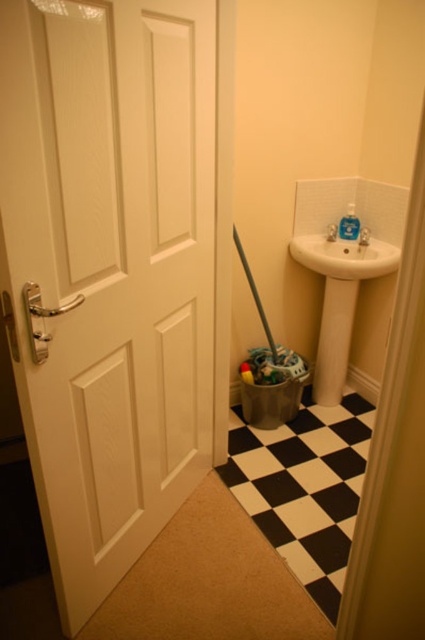
Question: Which of these objects is positioned farthest from the white matte door at left?

Choices:
 (A) white glossy sink at upper right
 (B) metallic silver brush at center

Answer: (A)

Question: Can you confirm if white matte door at left is bigger than white glossy sink at upper right?

Choices:
 (A) no
 (B) yes

Answer: (B)

Question: Which of the following is the closest to the observer?

Choices:
 (A) (371, 275)
 (B) (192, 376)

Answer: (B)

Question: Can you confirm if white matte door at left is positioned to the right of metallic silver brush at center?

Choices:
 (A) yes
 (B) no

Answer: (B)

Question: Does white matte door at left appear under white glossy sink at upper right?

Choices:
 (A) yes
 (B) no

Answer: (A)

Question: Which object is farther from the camera taking this photo?

Choices:
 (A) white matte door at left
 (B) white glossy sink at upper right

Answer: (B)